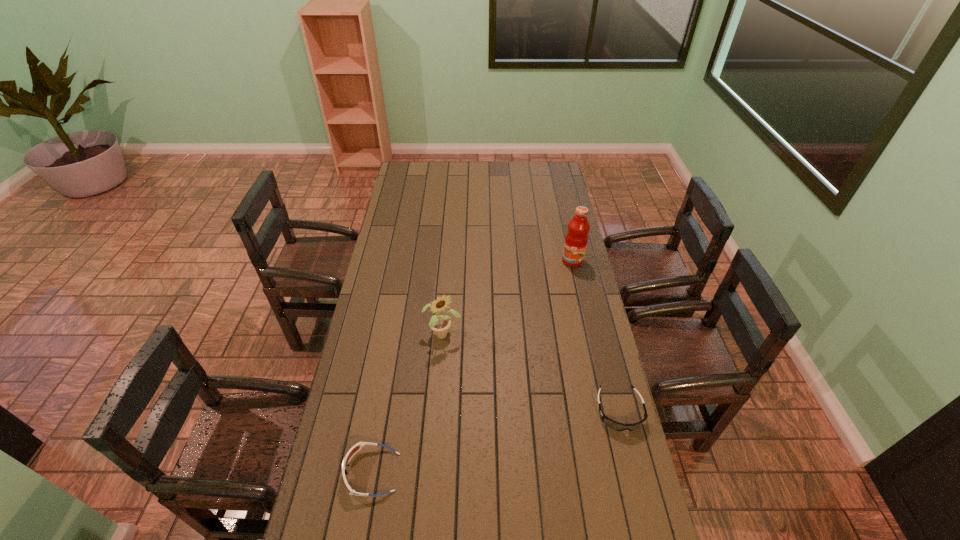
At what (x,y) coordinates should I click in order to perform the action: click on free point between the sunflower and the farthest object. Please return your answer as a coordinate pair (x, y). The height and width of the screenshot is (540, 960). Looking at the image, I should click on (508, 298).

The height and width of the screenshot is (540, 960). I want to click on empty location between the sunflower and the nearer goggles, so click(407, 403).

Where is `the closest object to the third farthest object`? The image size is (960, 540). the closest object to the third farthest object is located at coordinates (440, 324).

Locate which object ranks second in proximity to the sunflower. Please provide its 2D coordinates. Your answer should be formatted as a tuple, i.e. [(x, y)], where the tuple contains the x and y coordinates of a point satisfying the conditions above.

[(617, 426)]

Identify the location of free space that satisfies the following two spatial constraints: 1. on the back side of the second farthest object; 2. on the right side of the tallest object. This screenshot has width=960, height=540. (448, 261).